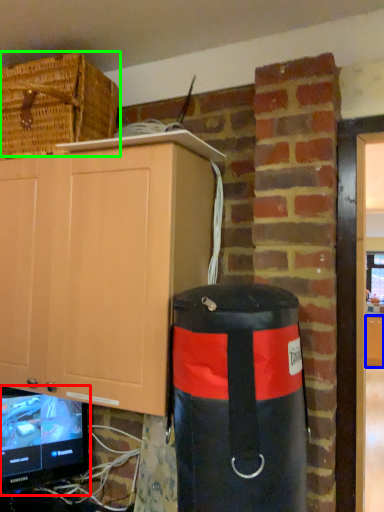
Question: Which is farther away from television (highlighted by a red box)? cabinetry (highlighted by a blue box) or basket (highlighted by a green box)?

Choices:
 (A) cabinetry
 (B) basket

Answer: (A)